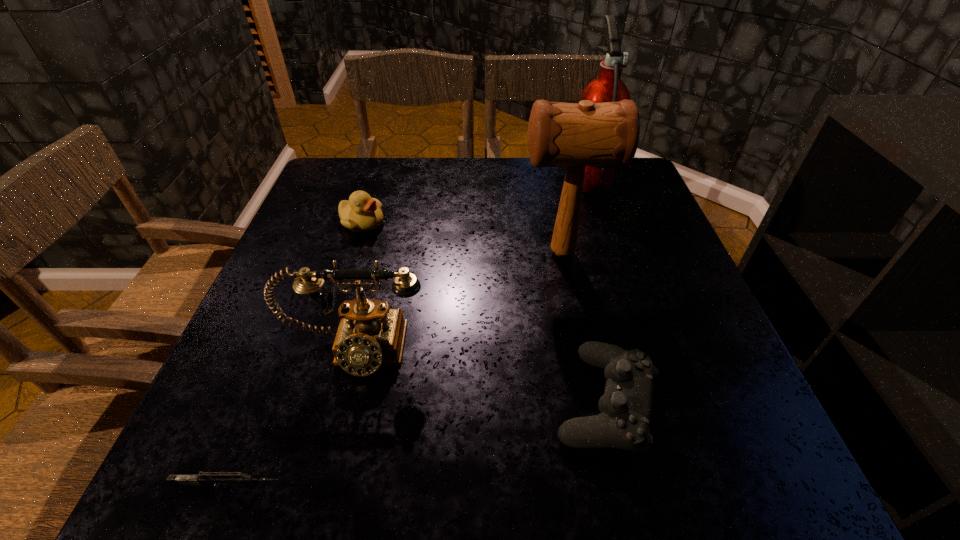
Where is `the farthest object`? This screenshot has width=960, height=540. the farthest object is located at coordinates (608, 87).

Image resolution: width=960 pixels, height=540 pixels. I want to click on mallet, so click(606, 134).

Find the location of a particular element. telephone is located at coordinates (371, 334).

Where is `duckling`? Image resolution: width=960 pixels, height=540 pixels. duckling is located at coordinates (362, 213).

Locate an element on the screen. This screenshot has height=540, width=960. the second shortest object is located at coordinates (625, 408).

Find the location of `gun`. gun is located at coordinates (218, 478).

Where is `the shortest object`? the shortest object is located at coordinates (218, 478).

You are a GUI agent. You are given a task and a screenshot of the screen. Output one action in this format:
    pyautogui.click(x=<x>, y=<y>)
    Task: Click on the free location located on the nozzle and handle of the fire extinguisher
    The height and width of the screenshot is (540, 960).
    Given the screenshot: What is the action you would take?
    pyautogui.click(x=458, y=176)

Where is `blank space located 0.170m on the nozzle and handle of the fire extinguisher`? This screenshot has width=960, height=540. blank space located 0.170m on the nozzle and handle of the fire extinguisher is located at coordinates (504, 176).

Where is `vacant point located 0.170m on the nozzle and handle of the fire extinguisher`? vacant point located 0.170m on the nozzle and handle of the fire extinguisher is located at coordinates (504, 176).